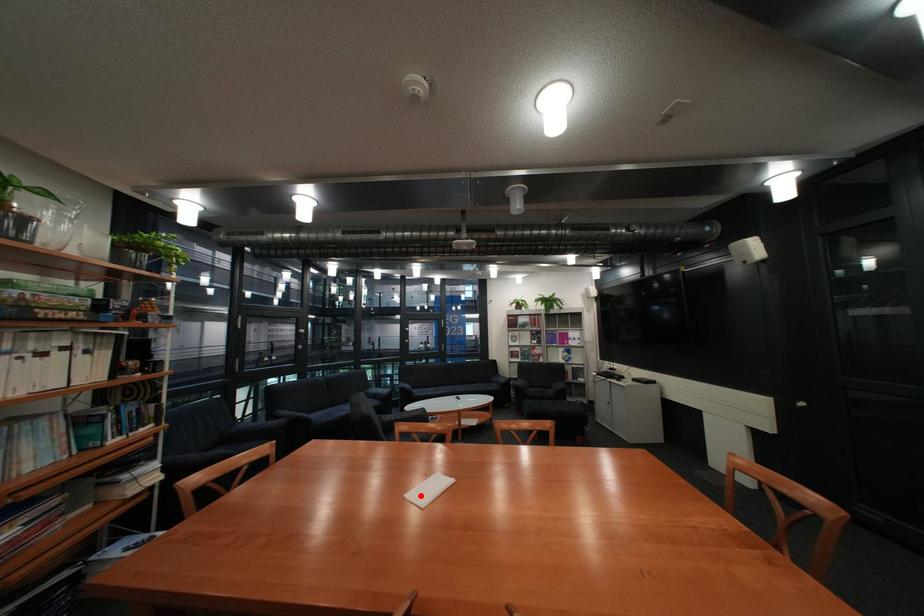
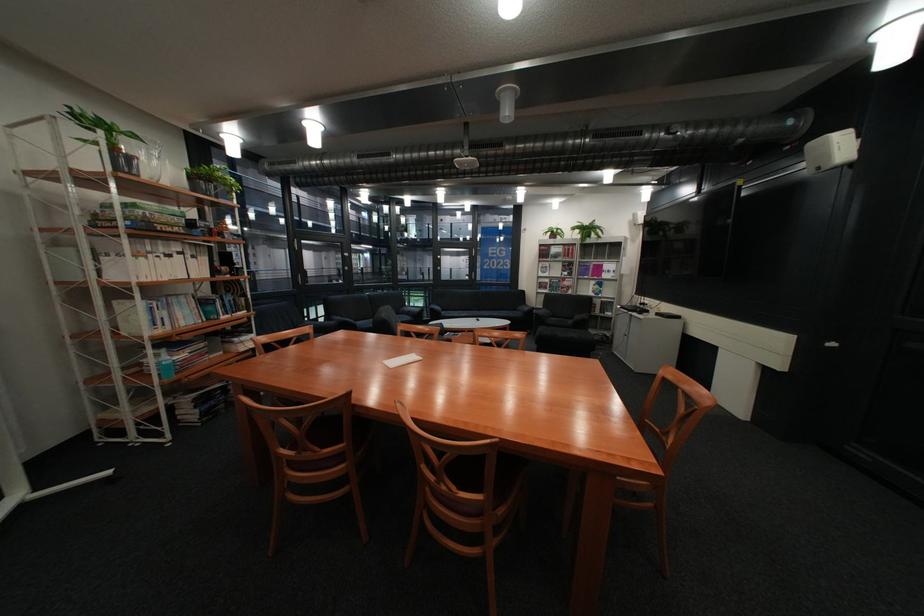
The point at the highlighted location is marked in the first image. Where is the corresponding point in the second image?

(398, 361)